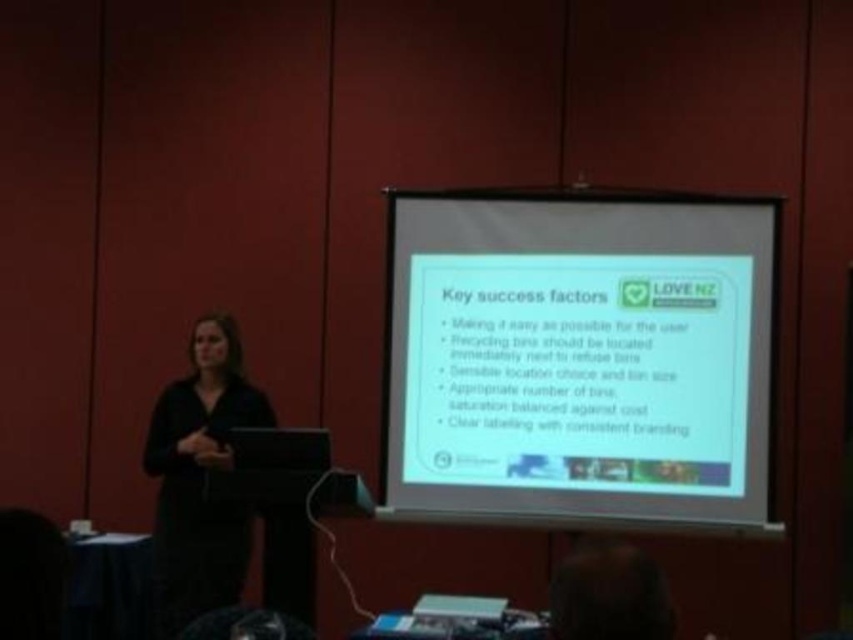
Does point (496, 484) come behind point (199, 596)?

No, (496, 484) is closer to viewer.

Identify the location of white paper at center. This screenshot has height=640, width=853. (579, 358).

Measure the distance between white paper at center and camera.

white paper at center and camera are 3.50 meters apart from each other.

Where is `white paper at center`? The height and width of the screenshot is (640, 853). white paper at center is located at coordinates (579, 358).